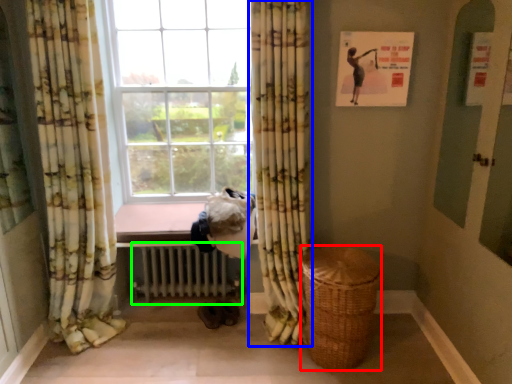
Question: Estimate the real-world distances between objects in this image. Which object is closer to basket (highlighted by a red box), curtain (highlighted by a blue box) or radiator (highlighted by a green box)?

Choices:
 (A) curtain
 (B) radiator

Answer: (A)